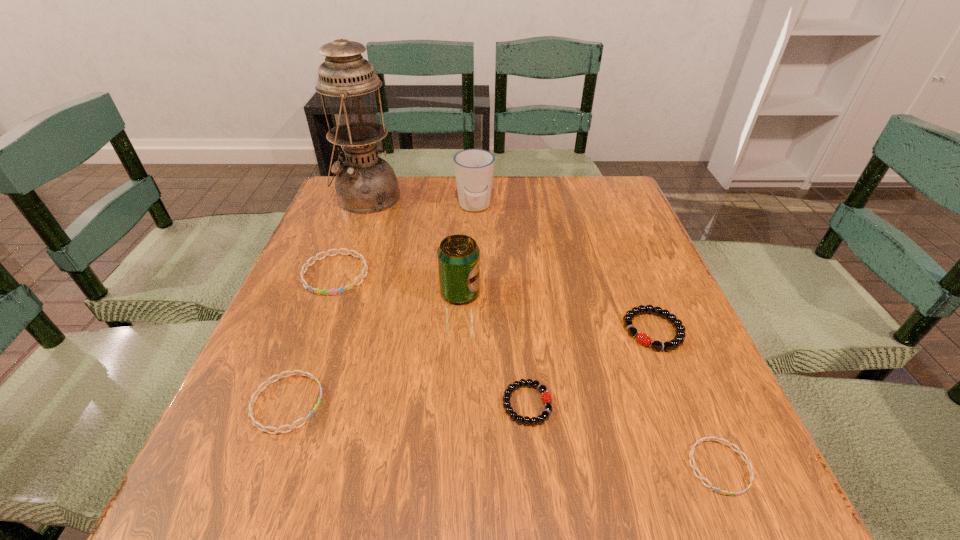
Where is `vacant space at the near right corner of the desktop`? This screenshot has height=540, width=960. vacant space at the near right corner of the desktop is located at coordinates (769, 511).

Identify the location of blank region between the second smallest blue bracelet and the third bracelet from right to left. The width and height of the screenshot is (960, 540). (407, 403).

In order to click on free space that is in between the farther black bracelet and the second nearest blue bracelet in this screenshot , I will do `click(470, 367)`.

Where is `free point between the nearer black bracelet and the green beer can`? free point between the nearer black bracelet and the green beer can is located at coordinates (493, 348).

Where is `vacant region between the tallest object and the cup`? The height and width of the screenshot is (540, 960). vacant region between the tallest object and the cup is located at coordinates (420, 202).

What are the coordinates of `empty space between the second biggest blue bracelet and the beer can` in the screenshot? It's located at (373, 348).

You are a GUI agent. You are given a task and a screenshot of the screen. Output one action in this format:
    pyautogui.click(x=<x>, y=<y>)
    Task: Click on the vacant region between the oil lamp and the green beer can
    This screenshot has width=960, height=540.
    Given the screenshot: What is the action you would take?
    pyautogui.click(x=414, y=245)

Where is `free area in between the second farthest bracelet and the farthest blue bracelet`? This screenshot has width=960, height=540. free area in between the second farthest bracelet and the farthest blue bracelet is located at coordinates (494, 302).

Where is `the closest object relative to the oil lamp`? the closest object relative to the oil lamp is located at coordinates (474, 168).

Identify which object is located as the nearest to the tallest object. Please provide its 2D coordinates. Your answer should be formatted as a tuple, i.e. [(x, y)], where the tuple contains the x and y coordinates of a point satisfying the conditions above.

[(474, 168)]